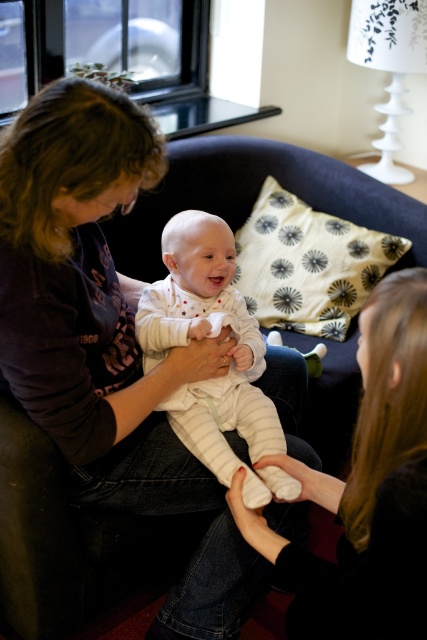
Question: Which is farther from the smooth black hair at upper right?

Choices:
 (A) matte black shirt at center
 (B) white striped onesie at center

Answer: (A)

Question: From the image, what is the correct spatial relationship of matte black shirt at center in relation to white striped onesie at center?

Choices:
 (A) below
 (B) above

Answer: (A)

Question: Does matte black shirt at center have a lesser width compared to smooth black hair at upper right?

Choices:
 (A) no
 (B) yes

Answer: (A)

Question: Which is farther from the smooth black hair at upper right?

Choices:
 (A) matte black shirt at center
 (B) white striped onesie at center

Answer: (A)

Question: Is matte black shirt at center positioned at the back of smooth black hair at upper right?

Choices:
 (A) no
 (B) yes

Answer: (B)

Question: Which object is farther from the camera taking this photo?

Choices:
 (A) smooth black hair at upper right
 (B) white striped onesie at center
 (C) matte black shirt at center

Answer: (B)